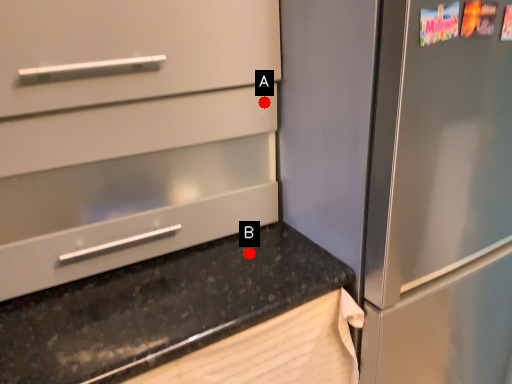
Question: Two points are circled on the image, labeled by A and B beside each circle. Which point is closer to the camera taking this photo?

Choices:
 (A) A is closer
 (B) B is closer

Answer: (A)